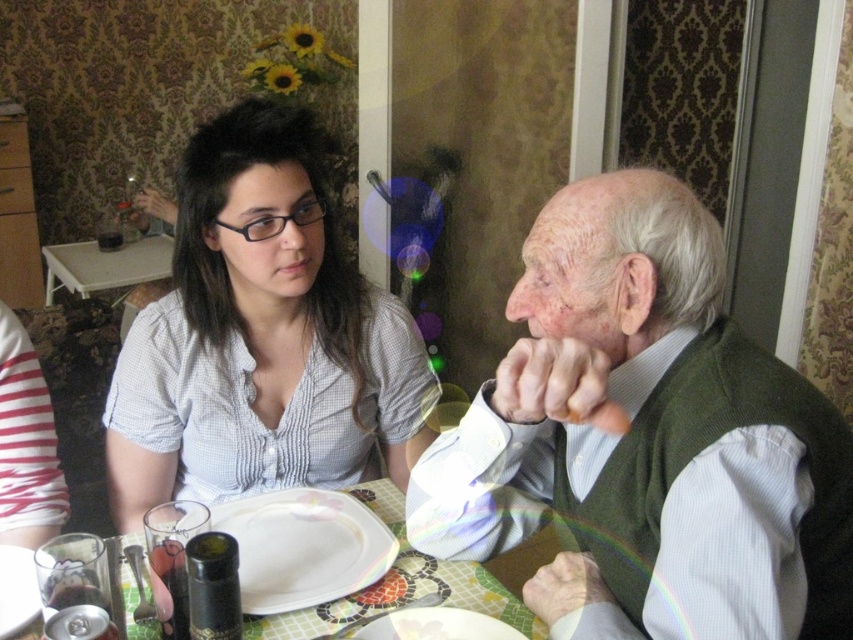
Question: Which object is the farthest from the green textured vest at right?

Choices:
 (A) white glossy plate at lower center
 (B) matte white shirt at center
 (C) white plastic table at upper left

Answer: (C)

Question: Does green textured vest at right have a lesser width compared to white plastic table at upper left?

Choices:
 (A) yes
 (B) no

Answer: (A)

Question: Estimate the real-world distances between objects in this image. Which object is farther from the matte white shirt at center?

Choices:
 (A) white glossy plate at lower center
 (B) white plastic table at upper left
 (C) white glossy plate at center

Answer: (B)

Question: In this image, where is matte white shirt at center located relative to white glossy plate at lower center?

Choices:
 (A) below
 (B) above

Answer: (B)

Question: Can you confirm if white glossy platter at center is thinner than white glossy plate at lower center?

Choices:
 (A) yes
 (B) no

Answer: (B)

Question: Which point is farther to the camera?

Choices:
 (A) coord(329,576)
 (B) coord(740,515)

Answer: (A)